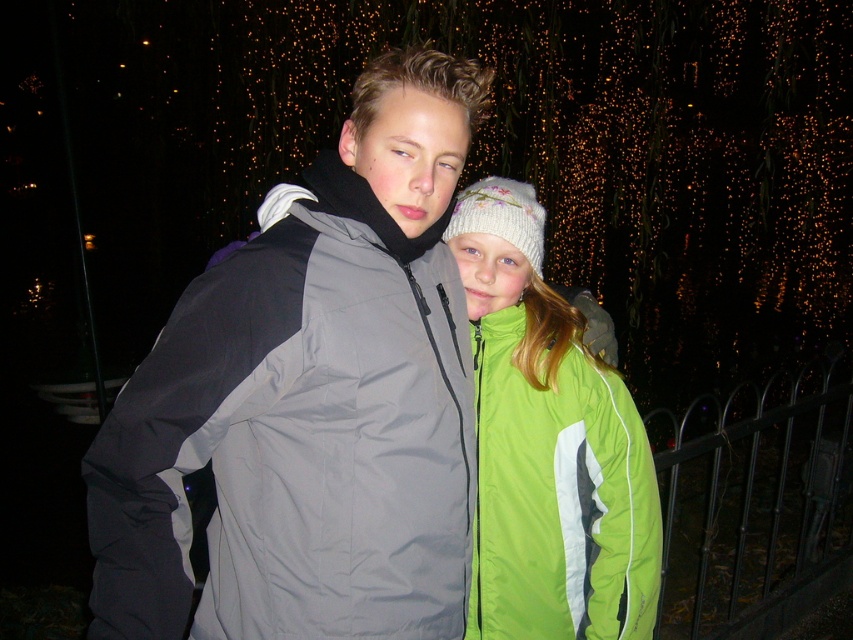
Question: Does gray synthetic jacket at center appear over black wrought iron fence at lower right?

Choices:
 (A) yes
 (B) no

Answer: (A)

Question: Does green fabric jacket at center have a lesser width compared to black wrought iron fence at lower right?

Choices:
 (A) yes
 (B) no

Answer: (A)

Question: Among these objects, which one is farthest from the camera?

Choices:
 (A) gray synthetic jacket at center
 (B) black wrought iron fence at lower right

Answer: (B)

Question: Which of the following is the farthest from the observer?

Choices:
 (A) (372, 604)
 (B) (820, 456)
 (C) (572, 317)

Answer: (B)

Question: Which object appears closest to the camera in this image?

Choices:
 (A) green fabric jacket at center
 (B) gray synthetic jacket at center

Answer: (B)

Question: Can you confirm if gray synthetic jacket at center is bigger than green fabric jacket at center?

Choices:
 (A) no
 (B) yes

Answer: (B)